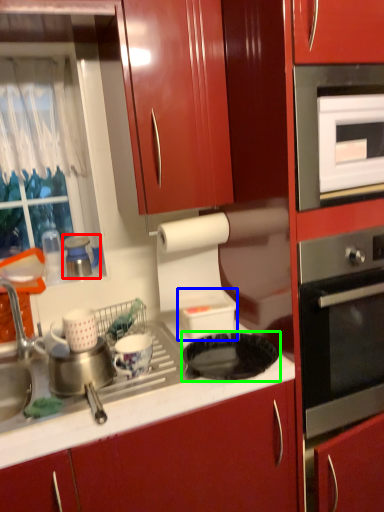
Question: Based on their relative distances, which object is nearer to appliance (highlighted by a red box)? Choose from appliance (highlighted by a blue box) and gas stove (highlighted by a green box).

Choices:
 (A) appliance
 (B) gas stove

Answer: (A)